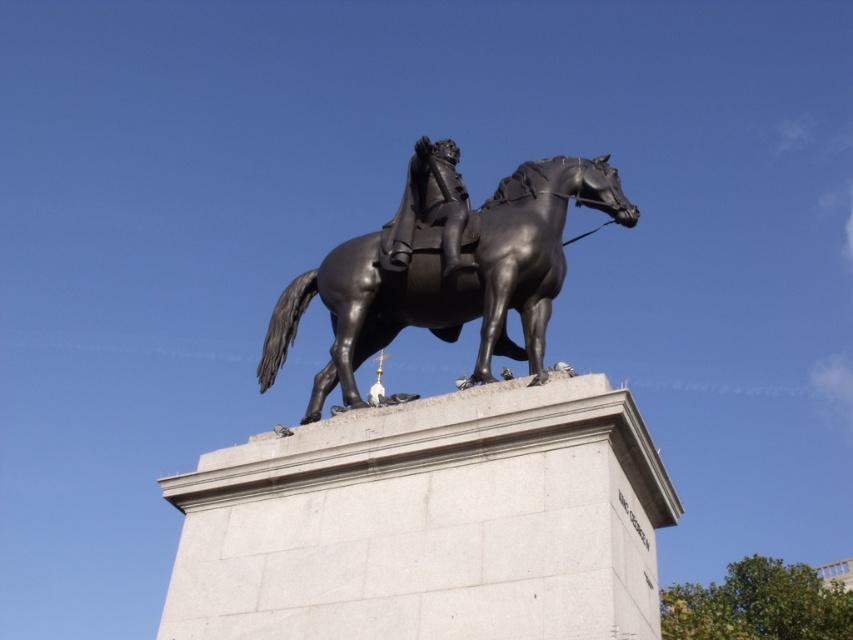
Question: Which point is closer to the camera?

Choices:
 (A) (416, 186)
 (B) (264, 356)
 (C) (386, 476)

Answer: (C)

Question: Is polished bronze horse at center to the right of polished bronze figure at center from the viewer's perspective?

Choices:
 (A) yes
 (B) no

Answer: (A)

Question: Can you confirm if bronze statue at center is positioned below polished bronze figure at center?

Choices:
 (A) no
 (B) yes

Answer: (B)

Question: Can you confirm if bronze statue at center is smaller than polished bronze horse at center?

Choices:
 (A) no
 (B) yes

Answer: (A)

Question: Which object is farther from the camera taking this photo?

Choices:
 (A) polished bronze figure at center
 (B) bronze statue at center

Answer: (A)

Question: Considering the real-world distances, which object is closest to the polished bronze figure at center?

Choices:
 (A) polished bronze horse at center
 (B) bronze statue at center

Answer: (A)